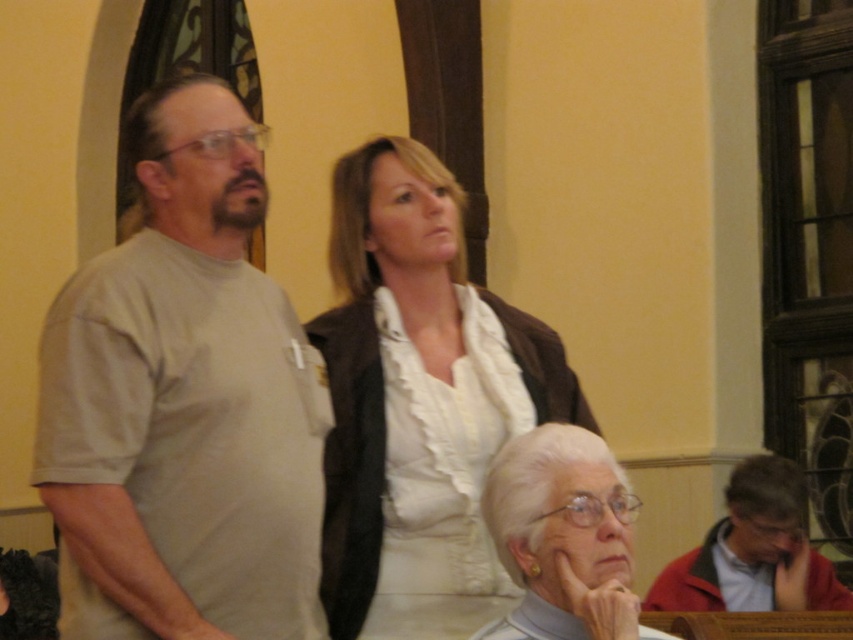
Which is below, white fabric at lower center or red jacket at lower right?

red jacket at lower right is below.

The image size is (853, 640). In order to click on white fabric at lower center in this screenshot , I will do `click(563, 538)`.

Between light gray t-shirt at left and white matte blouse at center, which one is positioned lower?

white matte blouse at center

Does light gray t-shirt at left come in front of white matte blouse at center?

That is True.

Is point (219, 534) positioned behind point (334, 579)?

No.

I want to click on light gray t-shirt at left, so click(183, 401).

Which is behind, point (280, 458) or point (757, 460)?

Positioned behind is point (757, 460).

The width and height of the screenshot is (853, 640). Identify the location of light gray t-shirt at left. (183, 401).